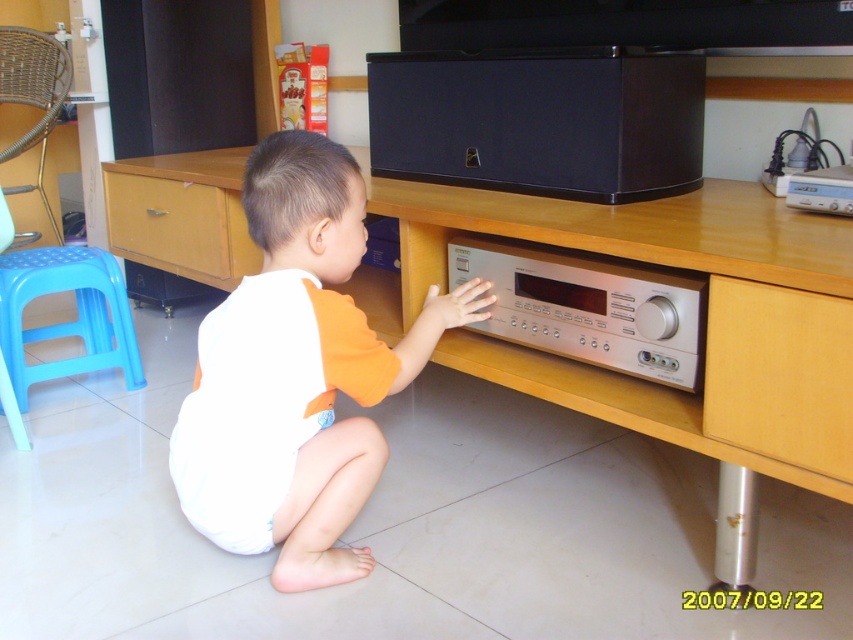
Does wooden drawer at lower right have a lesser height compared to blue plastic stool at left?

Yes, wooden drawer at lower right is shorter than blue plastic stool at left.

Does wooden drawer at lower right have a lesser width compared to blue plastic stool at left?

Correct, wooden drawer at lower right's width is less than blue plastic stool at left's.

Between point (778, 419) and point (0, 333), which one is positioned in front?

Positioned in front is point (778, 419).

Locate an element on the screen. wooden drawer at lower right is located at coordinates coord(779,374).

Locate an element on the screen. The height and width of the screenshot is (640, 853). white cotton toddler at center is located at coordinates (297, 372).

Find the location of a particular element. white cotton toddler at center is located at coordinates (297, 372).

Image resolution: width=853 pixels, height=640 pixels. I want to click on white cotton toddler at center, so click(297, 372).

Does white cotton toddler at center have a larger size compared to wooden drawer at lower left?

Yes, white cotton toddler at center is bigger than wooden drawer at lower left.

Which is more to the left, white cotton toddler at center or wooden drawer at lower left?

From the viewer's perspective, wooden drawer at lower left appears more on the left side.

Is point (306, 449) positioned behind point (144, 236)?

That is False.

Identify the location of white cotton toddler at center. The height and width of the screenshot is (640, 853). (297, 372).